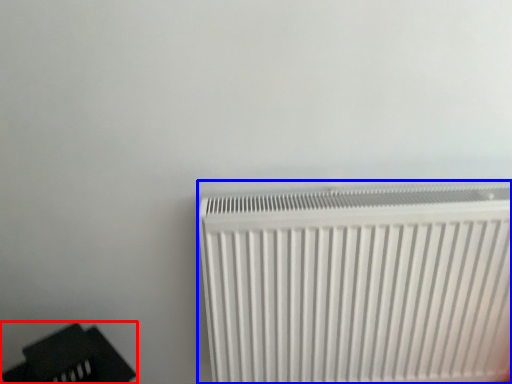
Question: Which of the following is the farthest to the observer, furniture (highlighted by a red box) or radiator (highlighted by a blue box)?

Choices:
 (A) furniture
 (B) radiator

Answer: (B)